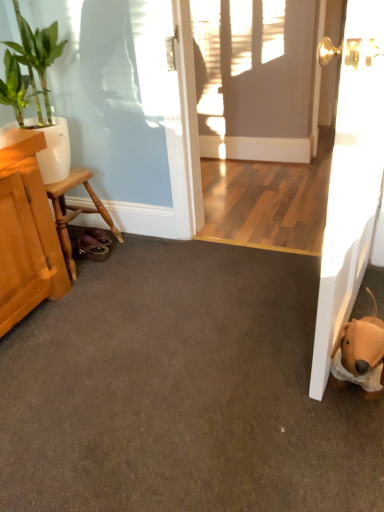
Question: Can you confirm if wooden stool at left is bigger than brown plush dog at lower right?

Choices:
 (A) no
 (B) yes

Answer: (B)

Question: Would you say brown plush dog at lower right is part of wooden stool at left's contents?

Choices:
 (A) no
 (B) yes

Answer: (A)

Question: From a real-world perspective, is wooden stool at left on brown plush dog at lower right?

Choices:
 (A) no
 (B) yes

Answer: (B)

Question: Can you confirm if wooden stool at left is shorter than brown plush dog at lower right?

Choices:
 (A) yes
 (B) no

Answer: (B)

Question: Could you tell me if wooden stool at left is turned towards brown plush dog at lower right?

Choices:
 (A) yes
 (B) no

Answer: (A)

Question: From a real-world perspective, is wooden stool at left physically below brown plush dog at lower right?

Choices:
 (A) no
 (B) yes

Answer: (A)

Question: Considering the relative positions of wooden stool at left and green glossy plant at upper left in the image provided, is wooden stool at left to the left of green glossy plant at upper left from the viewer's perspective?

Choices:
 (A) no
 (B) yes

Answer: (A)

Question: From the image's perspective, is wooden stool at left below green glossy plant at upper left?

Choices:
 (A) yes
 (B) no

Answer: (A)

Question: Can you confirm if wooden stool at left is wider than green glossy plant at upper left?

Choices:
 (A) no
 (B) yes

Answer: (A)

Question: Is wooden stool at left not close to green glossy plant at upper left?

Choices:
 (A) no
 (B) yes

Answer: (A)

Question: Is wooden stool at left beside green glossy plant at upper left?

Choices:
 (A) yes
 (B) no

Answer: (B)

Question: From a real-world perspective, is wooden stool at left positioned over green glossy plant at upper left based on gravity?

Choices:
 (A) yes
 (B) no

Answer: (B)

Question: Is white glossy door at right wider than green glossy plant at upper left?

Choices:
 (A) no
 (B) yes

Answer: (B)